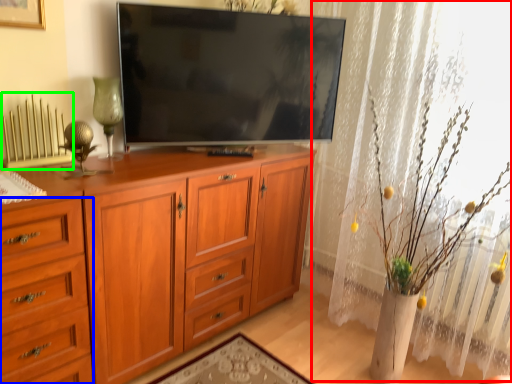
Question: Which object is the closest to the curtain (highlighted by a red box)? Choose among these: drawer (highlighted by a blue box) or radiator (highlighted by a green box).

Choices:
 (A) drawer
 (B) radiator

Answer: (A)